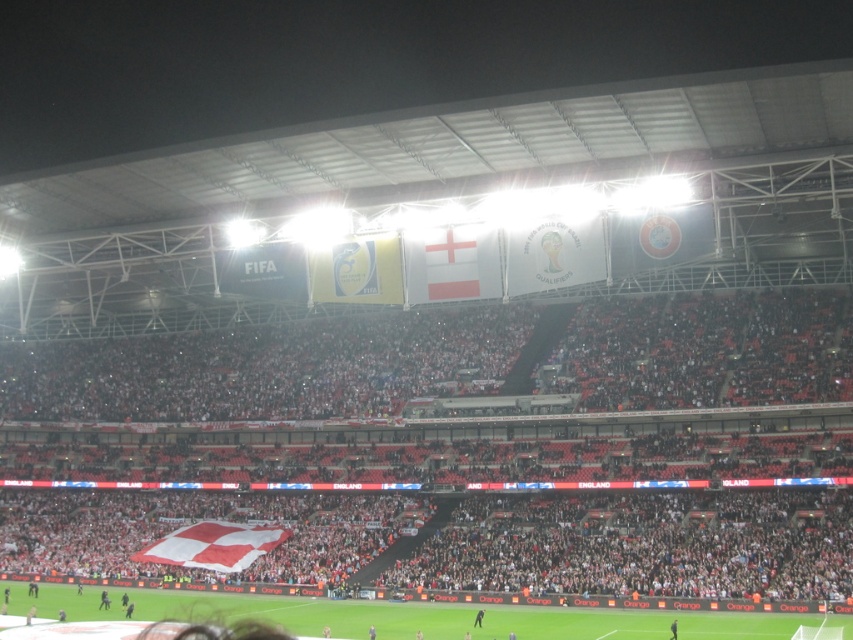
You are a drone operator tasked with capturing aerial footage of the stadium. You need to ensure that both the white fabric crowd at center and the smooth black suit at center are visible in the same shot. Given that your camera has a maximum focal length allowing it to capture objects up to 30 meters apart in the same frame, can you achieve this?

The distance between the white fabric crowd at center and the smooth black suit at center is 33.09 meters, which exceeds the camera maximum focal length of 30 meters. Therefore, the drone operator cannot capture both in the same shot.

You are a photographer at the stadium and want to capture a photo that includes both the white fabric crowd at center and the smooth black suit at center. Based on their positions, which object should you focus on first to ensure both are in the frame?

The white fabric crowd at center is located above the smooth black suit at center. To ensure both are in the frame, focus on the white fabric crowd at center first as it is higher up, then adjust the camera angle downward to include the smooth black suit at center.

You are a photographer positioned at the edge of the field during the match. You want to capture a photo that includes both the white fabric crowd at center and the smooth black suit at center. Based on their positions, which object should you pan your camera towards first to ensure both are in frame?

The white fabric crowd at center is to the left of the smooth black suit at center. To include both in the frame, you should pan your camera towards the white fabric crowd at center first, as it is positioned to the left, allowing the smooth black suit at center to come into view as you adjust the angle.